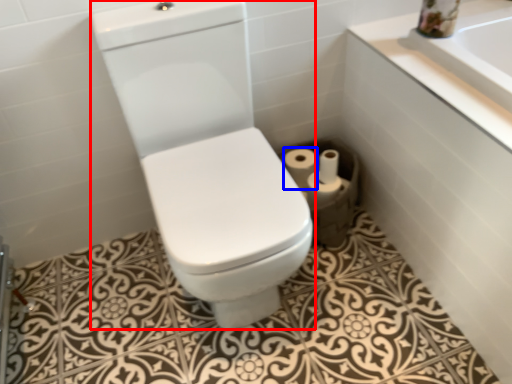
Question: Which object is closer to the camera taking this photo, sit (highlighted by a red box) or toilet paper (highlighted by a blue box)?

Choices:
 (A) sit
 (B) toilet paper

Answer: (A)